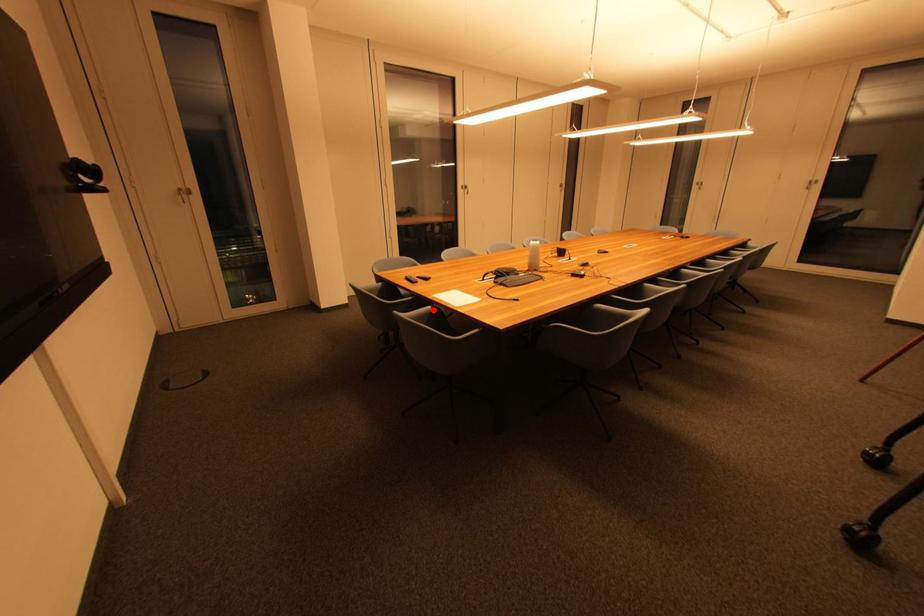
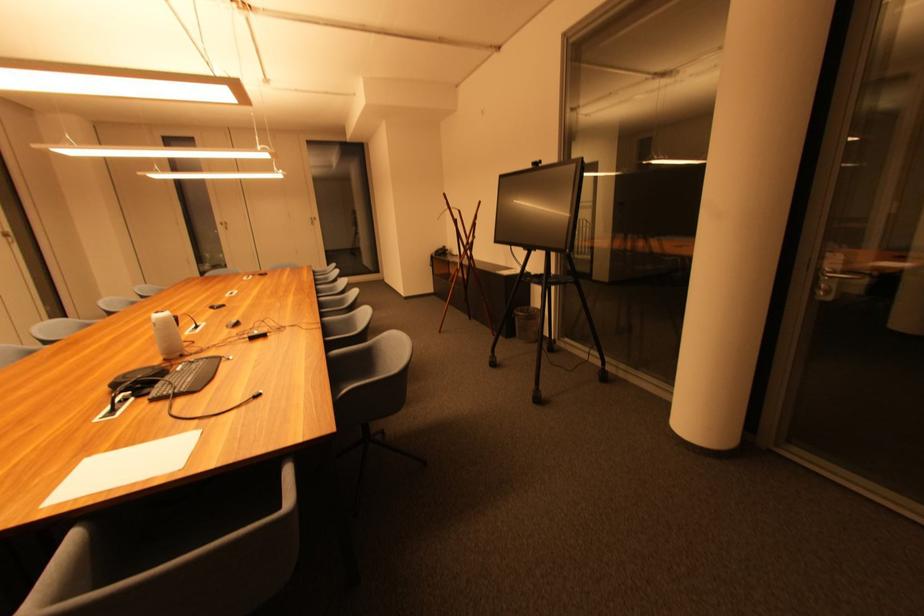
Locate, in the second image, the point that corresponds to the highlighted location in the first image.

(80, 538)